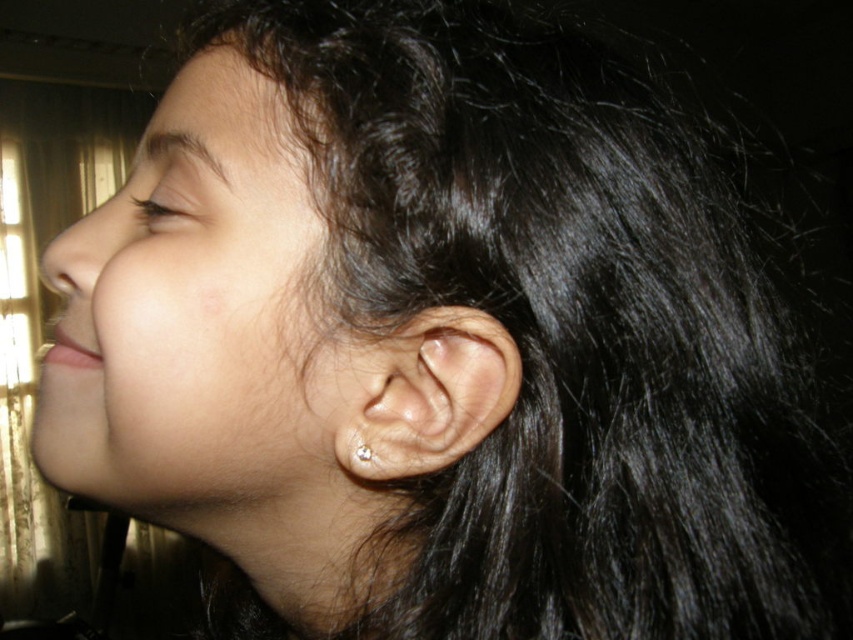
What do you see at coordinates (419, 392) in the screenshot? I see `clear skin ear at center` at bounding box center [419, 392].

The image size is (853, 640). What are the coordinates of `clear skin ear at center` in the screenshot? It's located at (419, 392).